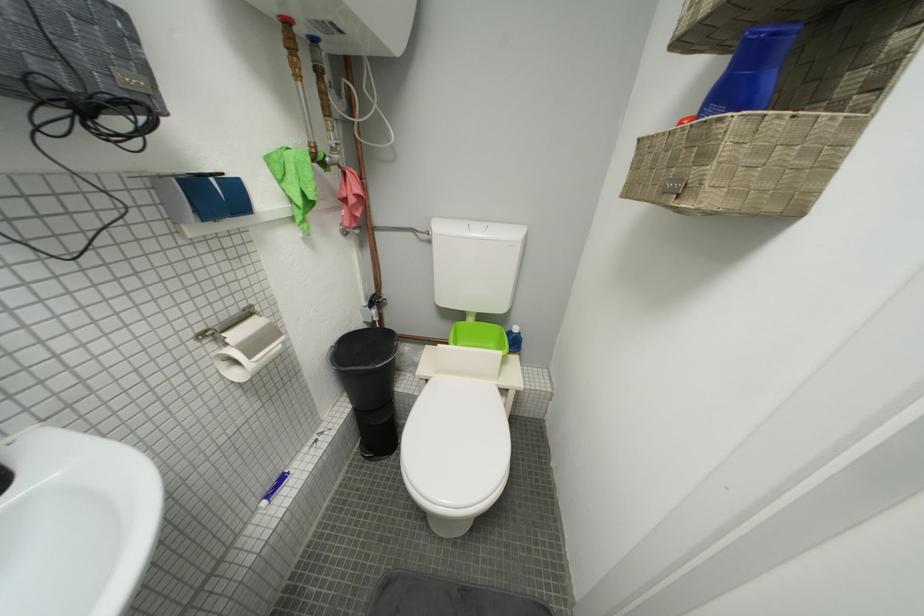
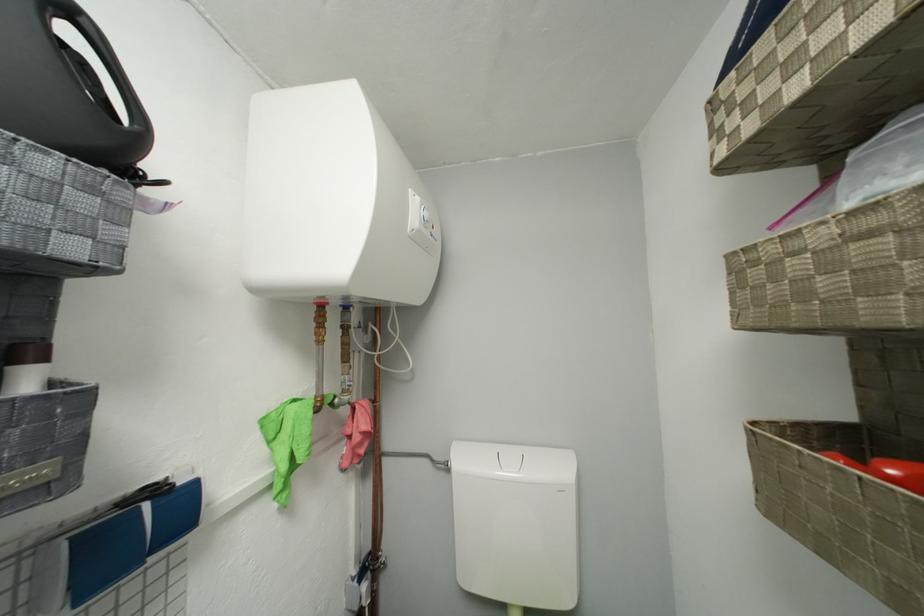
In the second image, find the point that corresponds to pixel 653 140 in the first image.

(781, 442)